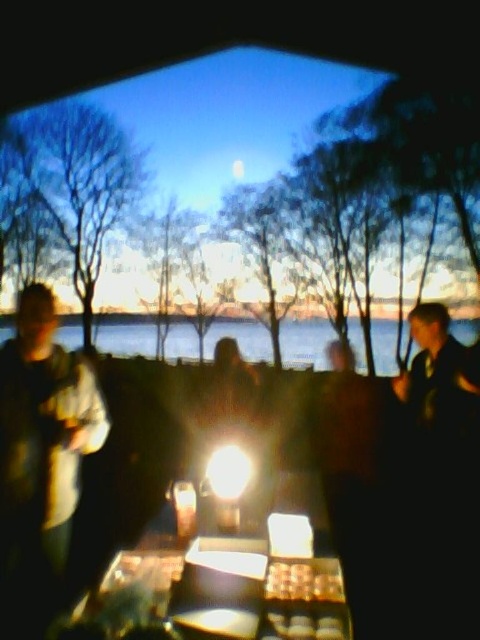
Is dark blue shirt at right further to the viewer compared to golden brown pastry at center?

That is True.

Is dark blue shirt at right bigger than golden brown pastry at center?

Correct, dark blue shirt at right is larger in size than golden brown pastry at center.

Is point (442, 305) more distant than point (336, 598)?

Yes, point (442, 305) is farther from viewer.

Locate an element on the screen. This screenshot has height=640, width=480. dark blue shirt at right is located at coordinates (434, 365).

How far apart are clear water at center and golden brown pastry at center?

clear water at center is 59.57 feet away from golden brown pastry at center.

Does clear water at center have a greater width compared to golden brown pastry at center?

Yes.

Is point (179, 355) positioned behind point (343, 600)?

Yes, it is.

Locate an element on the screen. clear water at center is located at coordinates (304, 342).

Which is more to the right, shiny metallic table at center or dark blue shirt at right?

From the viewer's perspective, dark blue shirt at right appears more on the right side.

Between shiny metallic table at center and dark blue shirt at right, which one appears on the left side from the viewer's perspective?

shiny metallic table at center

Which is in front, point (173, 611) or point (459, 385)?

Point (173, 611) is in front.

Where is `shiny metallic table at center`? Image resolution: width=480 pixels, height=640 pixels. shiny metallic table at center is located at coordinates point(228,570).